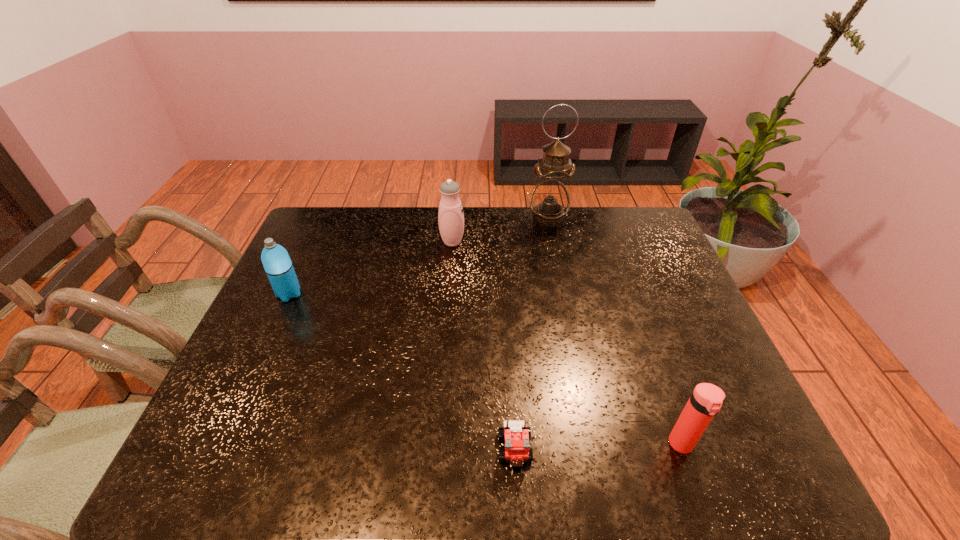
Locate an element on the screen. The image size is (960, 540). vacant space located on the right of the farthest object is located at coordinates (600, 218).

Identify the location of free region located 0.230m on the left of the farthest thermos bottle. This screenshot has height=540, width=960. (370, 242).

Where is `free space located on the right of the leftmost thermos bottle`? free space located on the right of the leftmost thermos bottle is located at coordinates (326, 294).

Image resolution: width=960 pixels, height=540 pixels. I want to click on blank space located on the back of the rightmost thermos bottle, so [x=634, y=310].

Image resolution: width=960 pixels, height=540 pixels. Identify the location of oil lamp that is positioned at the far edge. click(x=550, y=199).

Locate an element on the screen. This screenshot has height=540, width=960. thermos bottle at the far edge is located at coordinates (450, 216).

Find the location of a particular element. thermos bottle situated at the near edge is located at coordinates tap(705, 402).

The image size is (960, 540). I want to click on Lego that is at the near edge, so click(x=516, y=436).

Where is `object that is at the left edge`? object that is at the left edge is located at coordinates (276, 261).

Identify the location of object situated at the right edge. The height and width of the screenshot is (540, 960). (705, 402).